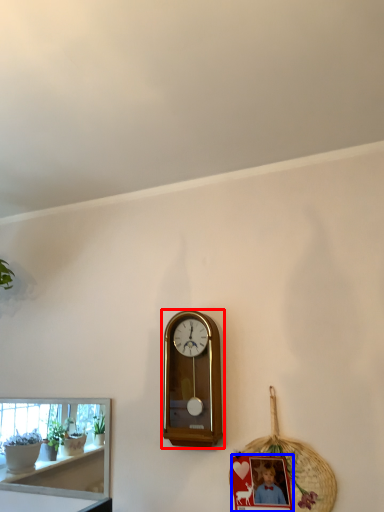
Question: Which of the following is the closest to the observer, wall clock (highlighted by a red box) or picture frame (highlighted by a blue box)?

Choices:
 (A) wall clock
 (B) picture frame

Answer: (B)